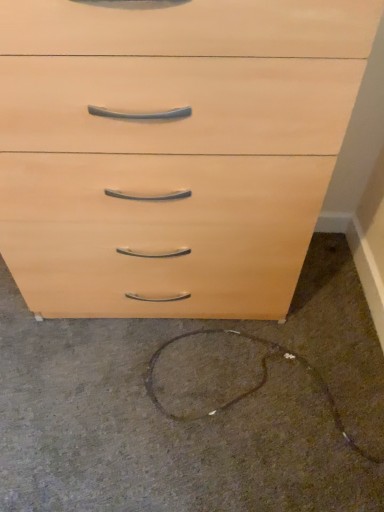
Question: Is brown carpet at lower center bigger than matte wood chest of drawers at center?

Choices:
 (A) no
 (B) yes

Answer: (A)

Question: From the image's perspective, is brown carpet at lower center below matte wood chest of drawers at center?

Choices:
 (A) no
 (B) yes

Answer: (B)

Question: Considering the relative positions of brown carpet at lower center and matte wood chest of drawers at center in the image provided, is brown carpet at lower center in front of matte wood chest of drawers at center?

Choices:
 (A) no
 (B) yes

Answer: (A)

Question: Does brown carpet at lower center come behind matte wood chest of drawers at center?

Choices:
 (A) yes
 (B) no

Answer: (A)

Question: Considering the relative sizes of brown carpet at lower center and matte wood chest of drawers at center in the image provided, is brown carpet at lower center shorter than matte wood chest of drawers at center?

Choices:
 (A) yes
 (B) no

Answer: (A)

Question: Is brown carpet at lower center oriented away from matte wood chest of drawers at center?

Choices:
 (A) yes
 (B) no

Answer: (B)

Question: Is matte wood chest of drawers at center turned away from brown carpet at lower center?

Choices:
 (A) yes
 (B) no

Answer: (B)

Question: Considering the relative sizes of matte wood chest of drawers at center and brown carpet at lower center in the image provided, is matte wood chest of drawers at center bigger than brown carpet at lower center?

Choices:
 (A) yes
 (B) no

Answer: (A)

Question: From a real-world perspective, is matte wood chest of drawers at center positioned over brown carpet at lower center based on gravity?

Choices:
 (A) yes
 (B) no

Answer: (A)

Question: From the image's perspective, is matte wood chest of drawers at center located above brown carpet at lower center?

Choices:
 (A) no
 (B) yes

Answer: (B)

Question: Does matte wood chest of drawers at center have a lesser width compared to brown carpet at lower center?

Choices:
 (A) yes
 (B) no

Answer: (A)

Question: Is there a large distance between matte wood chest of drawers at center and brown carpet at lower center?

Choices:
 (A) no
 (B) yes

Answer: (A)

Question: Relative to brown carpet at lower center, is matte wood chest of drawers at center in front or behind?

Choices:
 (A) behind
 (B) front

Answer: (B)